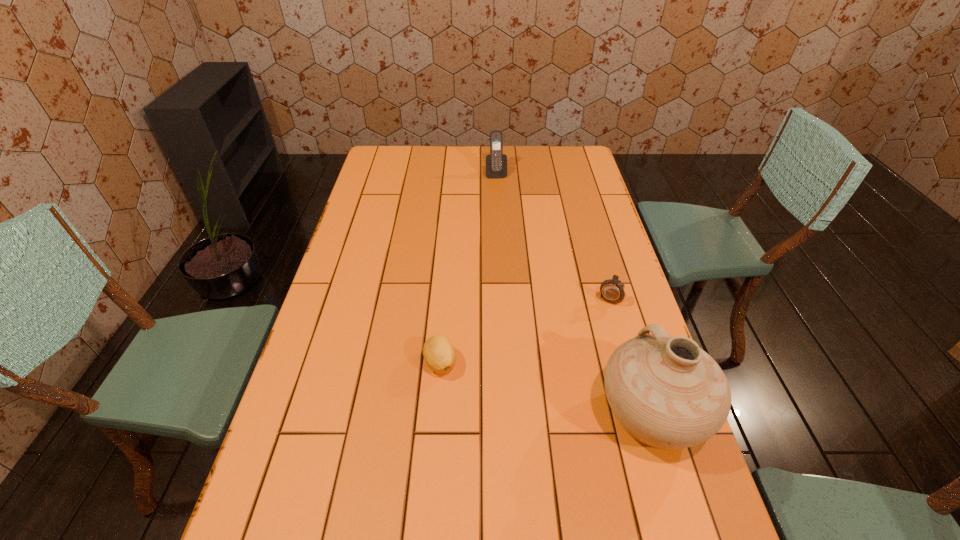
Find the location of a particular element. The image size is (960, 540). blank space at the right edge is located at coordinates (567, 210).

You are a GUI agent. You are given a task and a screenshot of the screen. Output one action in this format:
    pyautogui.click(x=<x>, y=<y>)
    Task: Click on the vacant space that's between the pottery and the shortest object
    The image size is (960, 540).
    Given the screenshot: What is the action you would take?
    pyautogui.click(x=546, y=388)

Locate an element on the screen. This screenshot has height=540, width=960. vacant space that's between the second tallest object and the pottery is located at coordinates (574, 293).

Where is `vacant area that lies between the shortest object and the cellular telephone`? vacant area that lies between the shortest object and the cellular telephone is located at coordinates click(468, 268).

Identify the location of free space between the shortest object and the third tallest object. (526, 328).

In order to click on free space between the shortest object and the pottery in this screenshot , I will do tap(546, 388).

Locate an element on the screen. The width and height of the screenshot is (960, 540). vacant area between the farthest object and the lemon is located at coordinates (468, 268).

Where is `vacant area that lies between the compass and the farthest object`? The height and width of the screenshot is (540, 960). vacant area that lies between the compass and the farthest object is located at coordinates (554, 234).

At what (x,y) coordinates should I click in order to perform the action: click on free space between the second tallest object and the compass. Please return your answer as a coordinate pair (x, y). Looking at the image, I should click on (554, 234).

Choose which object is the nearest neighbor to the leftmost object. Please provide its 2D coordinates. Your answer should be formatted as a tuple, i.e. [(x, y)], where the tuple contains the x and y coordinates of a point satisfying the conditions above.

[(667, 392)]